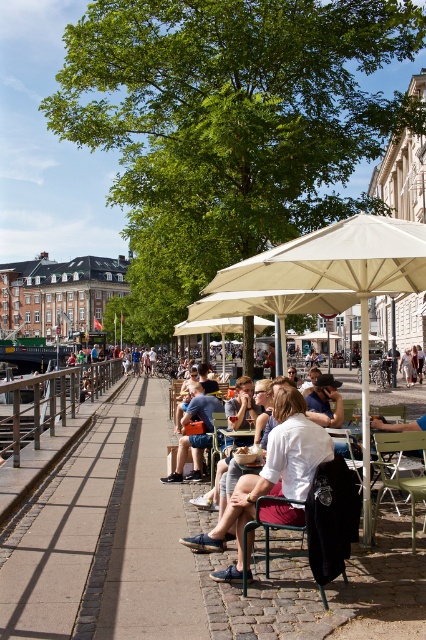
You are standing at the metal railing in the middle ground of the outdoor cafe scene. You notice two points marked in the image. Which point, point [298,452] or point [190,404], is closer to you?

Point [298,452] is closer to the viewer than point [190,404].

You are a photographer trying to capture a candid shot of two people sitting at a table in the outdoor cafe. The subjects are wearing a white cotton shirt at center and denim shorts at center. From the perspective of the photographer, which clothing item is positioned to the left?

The denim shorts at center are positioned to the left of the white cotton shirt at center.